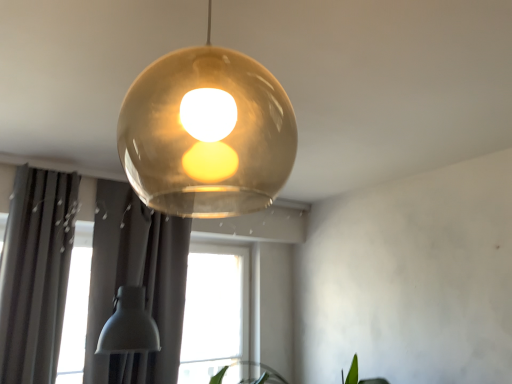
The height and width of the screenshot is (384, 512). What do you see at coordinates (207, 133) in the screenshot? I see `translucent amber sphere at center` at bounding box center [207, 133].

The width and height of the screenshot is (512, 384). What do you see at coordinates (136, 281) in the screenshot? I see `matte gray curtain at lower left, the 1th curtain from the right` at bounding box center [136, 281].

Identify the location of green leafy plant at lower right. Image resolution: width=512 pixels, height=384 pixels. [357, 375].

Locate an element on the screen. Image resolution: width=512 pixels, height=384 pixels. translucent amber sphere at center is located at coordinates (207, 133).

From the picture: How different are the orientations of translucent amber sphere at center and green leafy plant at lower right in degrees?

They differ by 0.295 degrees in their facing directions.

Which of these two, translucent amber sphere at center or green leafy plant at lower right, stands shorter?

green leafy plant at lower right.

From a real-world perspective, who is located higher, translucent amber sphere at center or green leafy plant at lower right?

In real-world perspective, translucent amber sphere at center is above.

Is translucent amber sphere at center positioned behind green leafy plant at lower right?

No.

Considering the sizes of objects green leafy plant at lower right and translucent amber sphere at center in the image provided, who is wider, green leafy plant at lower right or translucent amber sphere at center?

green leafy plant at lower right is wider.

From the picture: Does green leafy plant at lower right appear on the left side of translucent amber sphere at center?

In fact, green leafy plant at lower right is to the right of translucent amber sphere at center.

Which object is closer to the camera, green leafy plant at lower right or translucent amber sphere at center?

Positioned in front is translucent amber sphere at center.

In order to click on lamp above the green leafy plant at lower right (from the image's perspective) in this screenshot , I will do point(207,133).

Considering their positions, is dark gray fabric curtain at left, arranged as the 1th curtain when viewed from the left, located in front of or behind matte gray curtain at lower left, the 1th curtain from the right?

Visually, dark gray fabric curtain at left, arranged as the 1th curtain when viewed from the left, is located in front of matte gray curtain at lower left, the 1th curtain from the right.

Based on the photo, considering the sizes of dark gray fabric curtain at left, arranged as the 1th curtain when viewed from the left, and matte gray curtain at lower left, the 1th curtain from the right, in the image, is dark gray fabric curtain at left, arranged as the 1th curtain when viewed from the left, taller or shorter than matte gray curtain at lower left, the 1th curtain from the right,?

In the image, dark gray fabric curtain at left, arranged as the 1th curtain when viewed from the left, appears to be shorter than matte gray curtain at lower left, the 1th curtain from the right.

Based on the photo, is dark gray fabric curtain at left, arranged as the 1th curtain when viewed from the left, in contact with matte gray curtain at lower left, the 1th curtain from the right?

No, dark gray fabric curtain at left, arranged as the 1th curtain when viewed from the left, is not in contact with matte gray curtain at lower left, the 1th curtain from the right.

From the image's perspective, is dark gray fabric curtain at left, marked as the 2th curtain in a right-to-left arrangement, positioned above or below translucent amber sphere at center?

Clearly, from the image's perspective, dark gray fabric curtain at left, marked as the 2th curtain in a right-to-left arrangement, is below translucent amber sphere at center.

Considering the positions of objects dark gray fabric curtain at left, marked as the 2th curtain in a right-to-left arrangement, and translucent amber sphere at center in the image provided, who is more to the right, dark gray fabric curtain at left, marked as the 2th curtain in a right-to-left arrangement, or translucent amber sphere at center?

Positioned to the right is translucent amber sphere at center.

Between dark gray fabric curtain at left, marked as the 2th curtain in a right-to-left arrangement, and translucent amber sphere at center, which one is positioned in front?

translucent amber sphere at center is more forward.

Consider the image. Is dark gray fabric curtain at left, arranged as the 1th curtain when viewed from the left, looking in the opposite direction of translucent amber sphere at center?

dark gray fabric curtain at left, arranged as the 1th curtain when viewed from the left, is not turned away from translucent amber sphere at center.

Identify the location of lamp located above the matte gray curtain at lower left, the 1th curtain from the right (from the image's perspective). (207, 133).

Which object is closer to the camera taking this photo, translucent amber sphere at center or matte gray curtain at lower left, the 2th curtain from the left?

translucent amber sphere at center is in front.

Is translucent amber sphere at center oriented away from matte gray curtain at lower left, the 2th curtain from the left?

No, translucent amber sphere at center is not facing away from matte gray curtain at lower left, the 2th curtain from the left.

Is translucent amber sphere at center far from matte gray curtain at lower left, the 1th curtain from the right?

Actually, translucent amber sphere at center and matte gray curtain at lower left, the 1th curtain from the right, are a little close together.

Between point (162, 344) and point (231, 182), which one is positioned behind?

The point (231, 182) is more distant.

Looking at their sizes, would you say matte gray curtain at lower left, the 1th curtain from the right, is wider or thinner than translucent amber sphere at center?

A: Clearly, matte gray curtain at lower left, the 1th curtain from the right, has less width compared to translucent amber sphere at center.

Is matte gray curtain at lower left, the 2th curtain from the left, aimed at translucent amber sphere at center?

Yes, matte gray curtain at lower left, the 2th curtain from the left, is oriented towards translucent amber sphere at center.

From their relative heights in the image, would you say matte gray curtain at lower left, the 1th curtain from the right, is taller or shorter than translucent amber sphere at center?

In the image, matte gray curtain at lower left, the 1th curtain from the right, appears to be taller than translucent amber sphere at center.

Can you confirm if matte gray curtain at lower left, the 2th curtain from the left, is smaller than dark gray fabric curtain at left, marked as the 2th curtain in a right-to-left arrangement?

No.

Can you tell me how much matte gray curtain at lower left, the 1th curtain from the right, and dark gray fabric curtain at left, marked as the 2th curtain in a right-to-left arrangement, differ in facing direction?

They differ by 0.00011 degrees in their facing directions.

From the image's perspective, is matte gray curtain at lower left, the 2th curtain from the left, over dark gray fabric curtain at left, marked as the 2th curtain in a right-to-left arrangement?

Actually, matte gray curtain at lower left, the 2th curtain from the left, appears below dark gray fabric curtain at left, marked as the 2th curtain in a right-to-left arrangement, in the image.

Can you confirm if matte gray curtain at lower left, the 1th curtain from the right, is wider than dark gray fabric curtain at left, arranged as the 1th curtain when viewed from the left?

In fact, matte gray curtain at lower left, the 1th curtain from the right, might be narrower than dark gray fabric curtain at left, arranged as the 1th curtain when viewed from the left.

Locate an element on the screen. The image size is (512, 384). lamp above the green leafy plant at lower right (from a real-world perspective) is located at coordinates (207, 133).

Locate an element on the screen. plant lying below the translucent amber sphere at center (from the image's perspective) is located at coordinates (357, 375).

When comparing their distances from translucent amber sphere at center, does matte gray curtain at lower left, the 1th curtain from the right, or dark gray fabric curtain at left, arranged as the 1th curtain when viewed from the left, seem closer?

matte gray curtain at lower left, the 1th curtain from the right, lies closer to translucent amber sphere at center than the other object.

Estimate the real-world distances between objects in this image. Which object is further from translucent amber sphere at center, dark gray fabric curtain at left, marked as the 2th curtain in a right-to-left arrangement, or matte gray curtain at lower left, the 1th curtain from the right?

dark gray fabric curtain at left, marked as the 2th curtain in a right-to-left arrangement, lies further to translucent amber sphere at center than the other object.

Based on their spatial positions, is dark gray fabric curtain at left, marked as the 2th curtain in a right-to-left arrangement, or matte gray curtain at lower left, the 2th curtain from the left, further from green leafy plant at lower right?

dark gray fabric curtain at left, marked as the 2th curtain in a right-to-left arrangement, is further to green leafy plant at lower right.

Estimate the real-world distances between objects in this image. Which object is further from matte gray curtain at lower left, the 1th curtain from the right, green leafy plant at lower right or dark gray fabric curtain at left, arranged as the 1th curtain when viewed from the left?

green leafy plant at lower right is further to matte gray curtain at lower left, the 1th curtain from the right.

Which object lies nearer to the anchor point dark gray fabric curtain at left, arranged as the 1th curtain when viewed from the left, green leafy plant at lower right or translucent amber sphere at center?

Based on the image, translucent amber sphere at center appears to be nearer to dark gray fabric curtain at left, arranged as the 1th curtain when viewed from the left.

From the image, which object appears to be nearer to green leafy plant at lower right, matte gray curtain at lower left, the 1th curtain from the right, or dark gray fabric curtain at left, arranged as the 1th curtain when viewed from the left?

matte gray curtain at lower left, the 1th curtain from the right.

When comparing their distances from translucent amber sphere at center, does green leafy plant at lower right or dark gray fabric curtain at left, marked as the 2th curtain in a right-to-left arrangement, seem further?

green leafy plant at lower right is positioned further to the anchor translucent amber sphere at center.

Considering their positions, is matte gray curtain at lower left, the 2th curtain from the left, positioned further to green leafy plant at lower right than translucent amber sphere at center?

translucent amber sphere at center is further to green leafy plant at lower right.

This screenshot has height=384, width=512. In order to click on curtain positioned between translucent amber sphere at center and green leafy plant at lower right from near to far in this screenshot , I will do `click(36, 273)`.

Where is `plant between translucent amber sphere at center and matte gray curtain at lower left, the 2th curtain from the left, along the z-axis`? The image size is (512, 384). plant between translucent amber sphere at center and matte gray curtain at lower left, the 2th curtain from the left, along the z-axis is located at coordinates (357, 375).

The height and width of the screenshot is (384, 512). I want to click on curtain between dark gray fabric curtain at left, arranged as the 1th curtain when viewed from the left, and green leafy plant at lower right from left to right, so click(x=136, y=281).

Locate an element on the screen. This screenshot has width=512, height=384. curtain between translucent amber sphere at center and matte gray curtain at lower left, the 1th curtain from the right, from front to back is located at coordinates (36, 273).